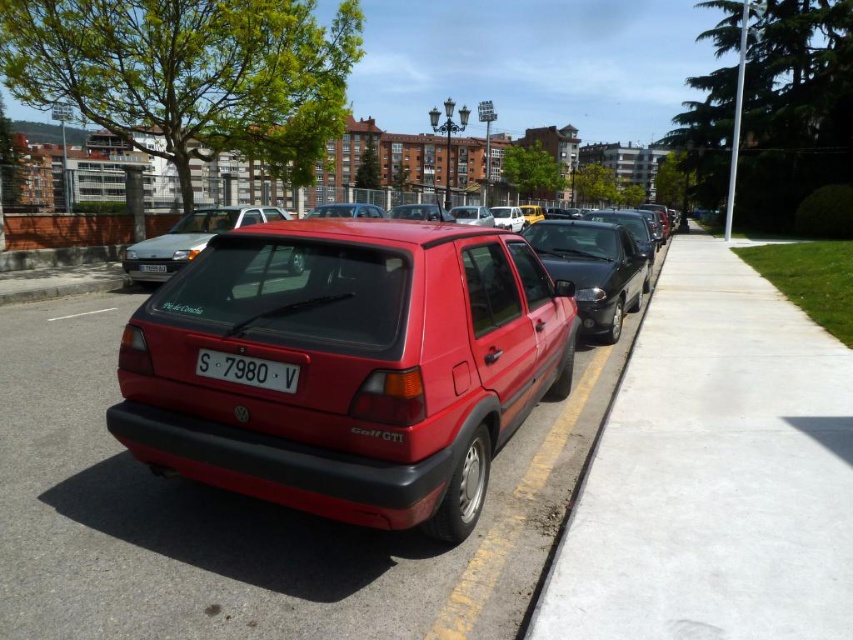
In the scene shown: Can you confirm if smooth concrete pavement at center is positioned to the right of white plastic license plate at center?

In fact, smooth concrete pavement at center is to the left of white plastic license plate at center.

Does smooth concrete pavement at center appear under white plastic license plate at center?

Yes, smooth concrete pavement at center is below white plastic license plate at center.

Which is in front, point (155, 550) or point (229, 353)?

Positioned in front is point (229, 353).

Locate an element on the screen. The height and width of the screenshot is (640, 853). smooth concrete pavement at center is located at coordinates (242, 516).

Is the position of concrete at center more distant than that of glossy black sedan at center?

No, it is in front of glossy black sedan at center.

Can you confirm if concrete at center is bigger than glossy black sedan at center?

Yes.

Does point (773, 433) come closer to viewer compared to point (619, 324)?

Yes, point (773, 433) is in front of point (619, 324).

This screenshot has width=853, height=640. I want to click on concrete at center, so click(714, 472).

Can you confirm if satin silver hatchback at center is taller than white plastic license plate at rear?

Indeed, satin silver hatchback at center has a greater height compared to white plastic license plate at rear.

Between satin silver hatchback at center and white plastic license plate at rear, which one is positioned higher?

Positioned higher is satin silver hatchback at center.

Does point (273, 208) come in front of point (160, 268)?

No, (273, 208) is further to viewer.

The image size is (853, 640). Find the location of `satin silver hatchback at center`. satin silver hatchback at center is located at coordinates (190, 237).